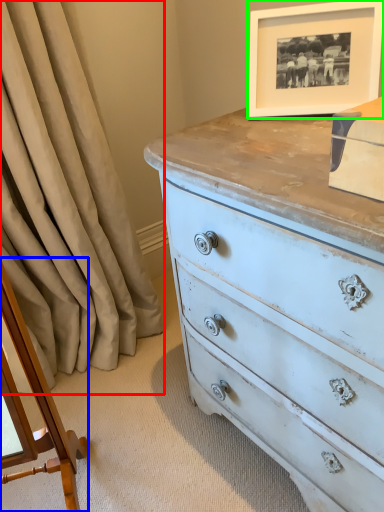
Question: Based on their relative distances, which object is farther from curtain (highlighted by a red box)? Choose from changing table (highlighted by a blue box) and picture frame (highlighted by a green box).

Choices:
 (A) changing table
 (B) picture frame

Answer: (B)